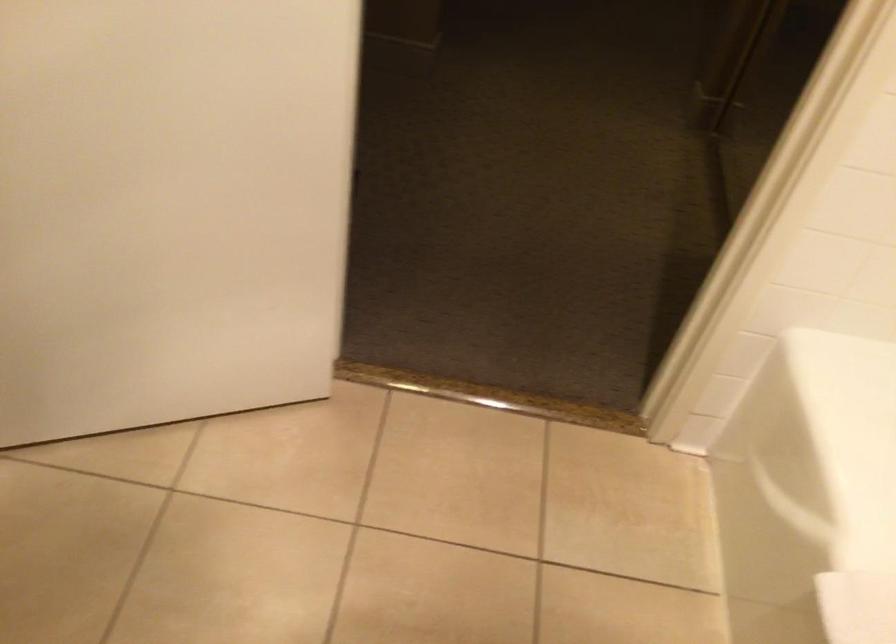
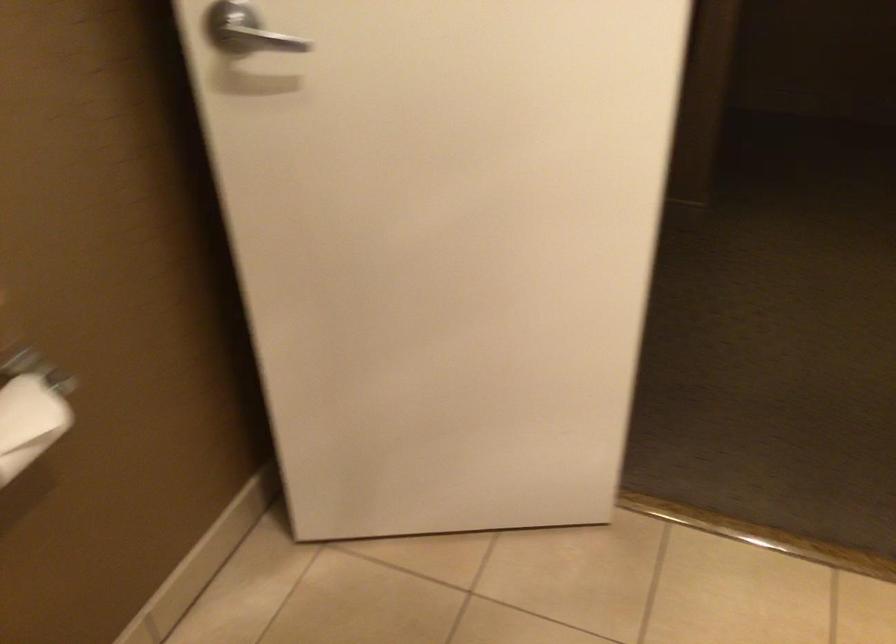
Question: What movement of the cameraman would produce the second image?

Choices:
 (A) Left
 (B) Right
 (C) Forward
 (D) Backward

Answer: (D)